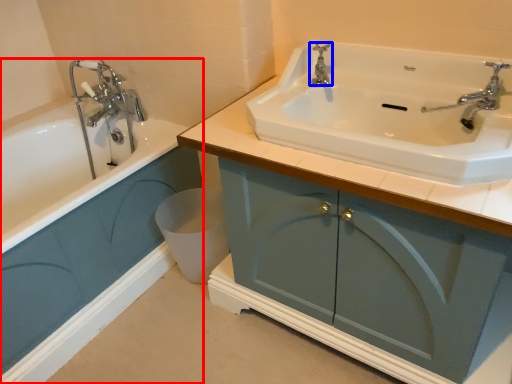
Question: Among these objects, which one is farthest to the camera, bathroom cabinet (highlighted by a red box) or tap (highlighted by a blue box)?

Choices:
 (A) bathroom cabinet
 (B) tap

Answer: (B)